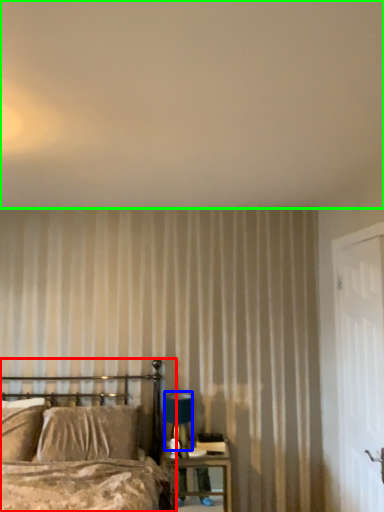
Question: Based on their relative distances, which object is nearer to bed (highlighted by a red box)? Choose from table lamp (highlighted by a blue box) and backdrop (highlighted by a green box).

Choices:
 (A) table lamp
 (B) backdrop

Answer: (A)